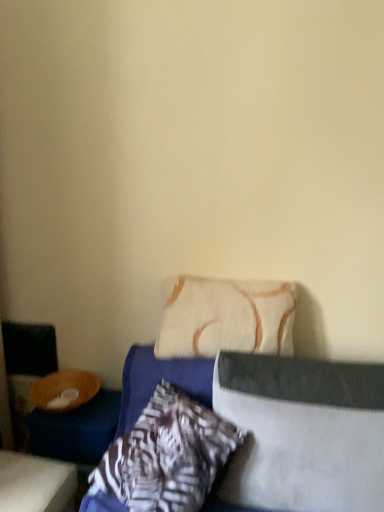
Question: Considering the relative sizes of beige textured pillow at center, the 2th pillow from the left, and textured blue bed at center in the image provided, is beige textured pillow at center, the 2th pillow from the left, thinner than textured blue bed at center?

Choices:
 (A) no
 (B) yes

Answer: (B)

Question: From a real-world perspective, is beige textured pillow at center, the 2th pillow from the left, positioned over textured blue bed at center based on gravity?

Choices:
 (A) no
 (B) yes

Answer: (B)

Question: Considering the relative positions of beige textured pillow at center, the 2th pillow from the left, and textured blue bed at center in the image provided, is beige textured pillow at center, the 2th pillow from the left, to the right of textured blue bed at center from the viewer's perspective?

Choices:
 (A) yes
 (B) no

Answer: (B)

Question: Considering the relative sizes of beige textured pillow at center, which is counted as the 2th pillow, starting from the right, and textured blue bed at center in the image provided, is beige textured pillow at center, which is counted as the 2th pillow, starting from the right, shorter than textured blue bed at center?

Choices:
 (A) yes
 (B) no

Answer: (A)

Question: From a real-world perspective, does beige textured pillow at center, the 2th pillow from the left, sit lower than textured blue bed at center?

Choices:
 (A) yes
 (B) no

Answer: (B)

Question: Looking at their shapes, would you say beige textured pillow at center, the 2th pillow from the left, is wider or thinner than textured blue bed at center?

Choices:
 (A) wide
 (B) thin

Answer: (B)

Question: Would you say beige textured pillow at center, which is counted as the 2th pillow, starting from the right, is to the left or to the right of textured blue bed at center in the picture?

Choices:
 (A) left
 (B) right

Answer: (A)

Question: Is point (178, 339) positioned closer to the camera than point (102, 470)?

Choices:
 (A) closer
 (B) farther

Answer: (B)

Question: Considering their positions, is beige textured pillow at center, the 2th pillow from the left, located in front of or behind textured blue bed at center?

Choices:
 (A) front
 (B) behind

Answer: (B)

Question: In terms of width, does beige textured pillow at center, which is counted as the 2th pillow, starting from the right, look wider or thinner when compared to textured beige pillow at center, which ranks as the 3th pillow in left-to-right order?

Choices:
 (A) wide
 (B) thin

Answer: (B)

Question: From the image's perspective, relative to textured beige pillow at center, which ranks as the 3th pillow in left-to-right order, is beige textured pillow at center, the 2th pillow from the left, above or below?

Choices:
 (A) below
 (B) above

Answer: (B)

Question: Would you say beige textured pillow at center, the 2th pillow from the left, is inside or outside textured beige pillow at center, which ranks as the 3th pillow in left-to-right order?

Choices:
 (A) outside
 (B) inside

Answer: (A)

Question: From a real-world perspective, is beige textured pillow at center, the 2th pillow from the left, positioned above or below textured beige pillow at center, which ranks as the 3th pillow in left-to-right order?

Choices:
 (A) above
 (B) below

Answer: (A)

Question: Based on their sizes in the image, would you say textured beige pillow at center, the first pillow in the right-to-left sequence, is bigger or smaller than wooden table at lower left?

Choices:
 (A) big
 (B) small

Answer: (A)

Question: From a real-world perspective, is textured beige pillow at center, which ranks as the 3th pillow in left-to-right order, above or below wooden table at lower left?

Choices:
 (A) above
 (B) below

Answer: (A)